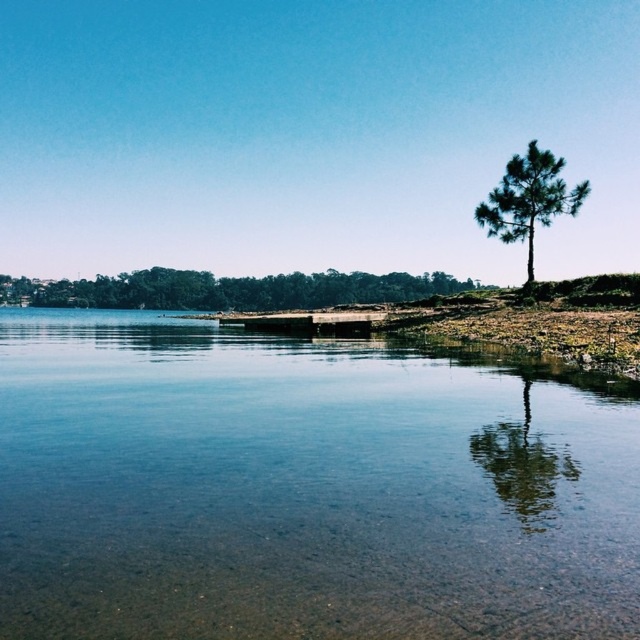
Is clear water at center below wooden dock at center?

Indeed, clear water at center is positioned under wooden dock at center.

Is clear water at center to the right of wooden dock at center from the viewer's perspective?

No, clear water at center is not to the right of wooden dock at center.

Measure the distance between clear water at center and camera.

A distance of 9.13 meters exists between clear water at center and camera.

Image resolution: width=640 pixels, height=640 pixels. I want to click on clear water at center, so click(x=301, y=488).

Does green matte tree at center have a smaller size compared to wooden dock at center?

No, green matte tree at center is not smaller than wooden dock at center.

What do you see at coordinates (228, 289) in the screenshot? Image resolution: width=640 pixels, height=640 pixels. I see `green matte tree at center` at bounding box center [228, 289].

Locate an element on the screen. The image size is (640, 640). green matte tree at center is located at coordinates (228, 289).

Which of these two, green matte tree at center or green matte tree at upper right, stands taller?

green matte tree at center

Does green matte tree at center have a lesser height compared to green matte tree at upper right?

Incorrect, green matte tree at center's height does not fall short of green matte tree at upper right's.

Between point (416, 292) and point (518, 240), which one is positioned in front?

Positioned in front is point (518, 240).

This screenshot has height=640, width=640. Identify the location of green matte tree at center. (228, 289).